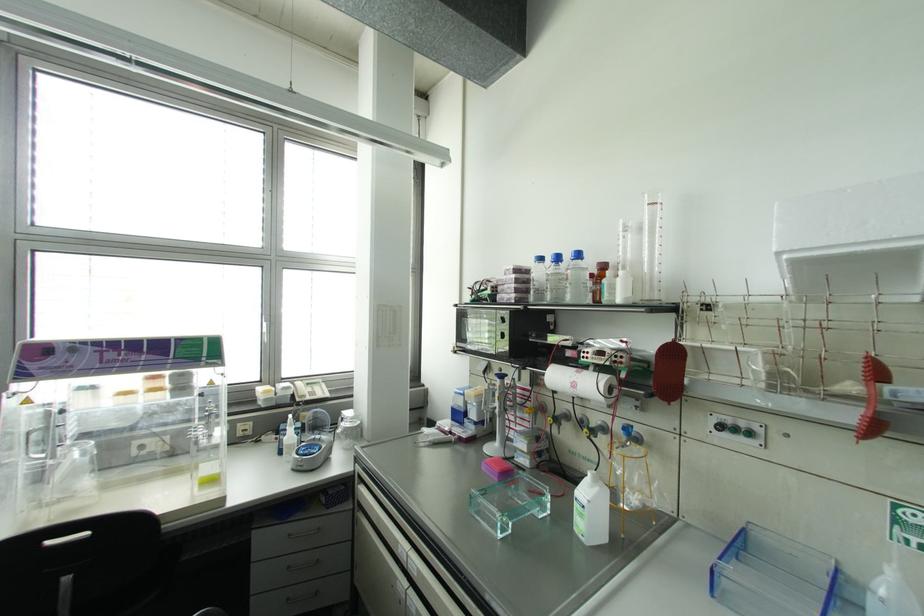
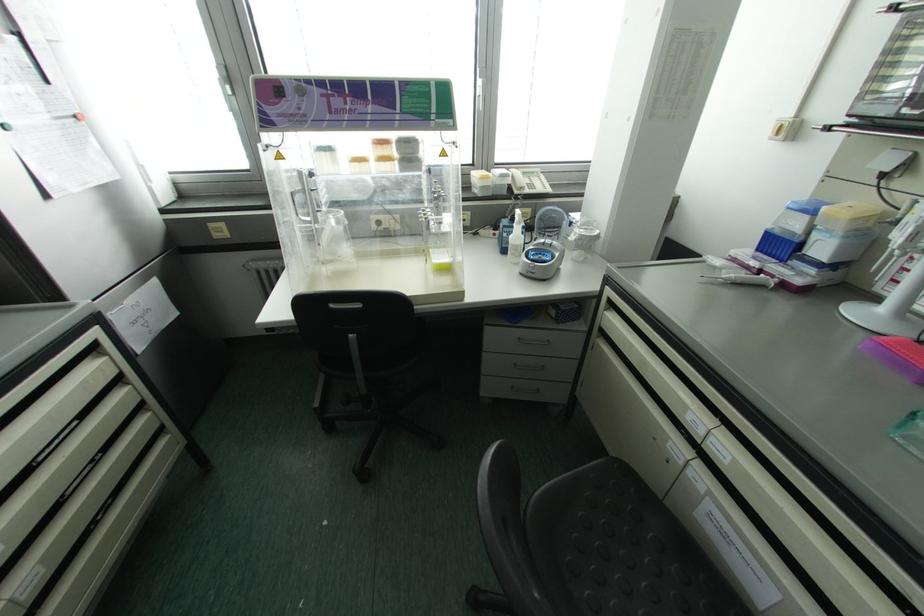
The point at (95, 342) is marked in the first image. Where is the corresponding point in the second image?

(320, 82)